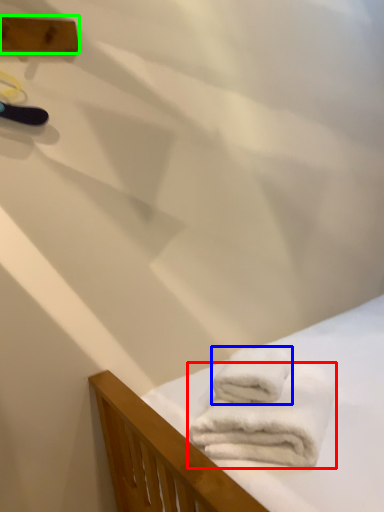
Question: Which object is the closest to the towel (highlighted by a red box)? Choose among these: towel (highlighted by a blue box) or plank (highlighted by a green box).

Choices:
 (A) towel
 (B) plank

Answer: (A)